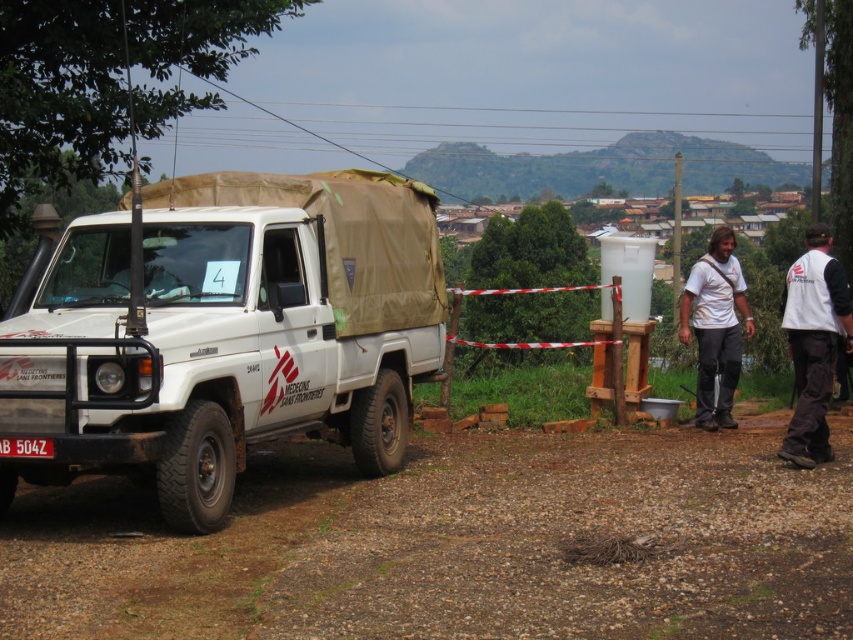
Question: Does white fabric vest at right appear over white t-shirt at center?

Choices:
 (A) no
 (B) yes

Answer: (B)

Question: Among these points, which one is farthest from the camera?

Choices:
 (A) (688, 317)
 (B) (759, 545)

Answer: (A)

Question: Estimate the real-world distances between objects in this image. Which object is closer to the white t-shirt at center?

Choices:
 (A) brown gravel dirt at lower left
 (B) white matte truck at left
 (C) white fabric vest at right

Answer: (C)

Question: Which object is the closest to the white fabric vest at right?

Choices:
 (A) brown gravel dirt at lower left
 (B) white matte truck at left
 (C) white t-shirt at center

Answer: (C)

Question: Does brown gravel dirt at lower left have a smaller size compared to white matte truck at left?

Choices:
 (A) no
 (B) yes

Answer: (B)

Question: Can you confirm if brown gravel dirt at lower left is wider than white fabric vest at right?

Choices:
 (A) no
 (B) yes

Answer: (A)